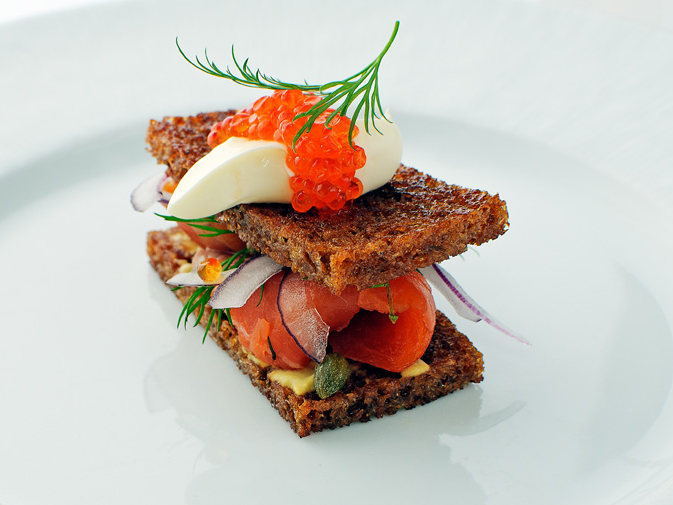
You are a GUI agent. You are given a task and a screenshot of the screen. Output one action in this format:
    pyautogui.click(x=<x>, y=<y>)
    Task: Click on the plate
    
    Given the screenshot: What is the action you would take?
    pyautogui.click(x=579, y=413), pyautogui.click(x=81, y=375)